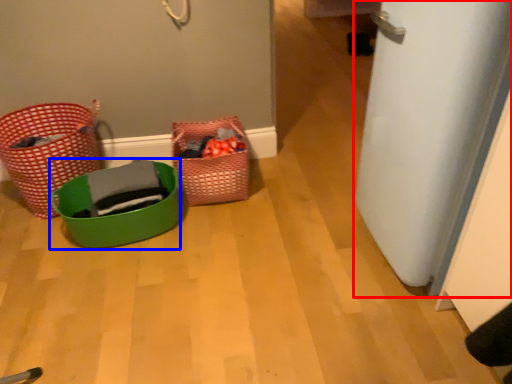
Question: Which of the following is the farthest to the observer, door (highlighted by a red box) or basket (highlighted by a blue box)?

Choices:
 (A) door
 (B) basket

Answer: (B)